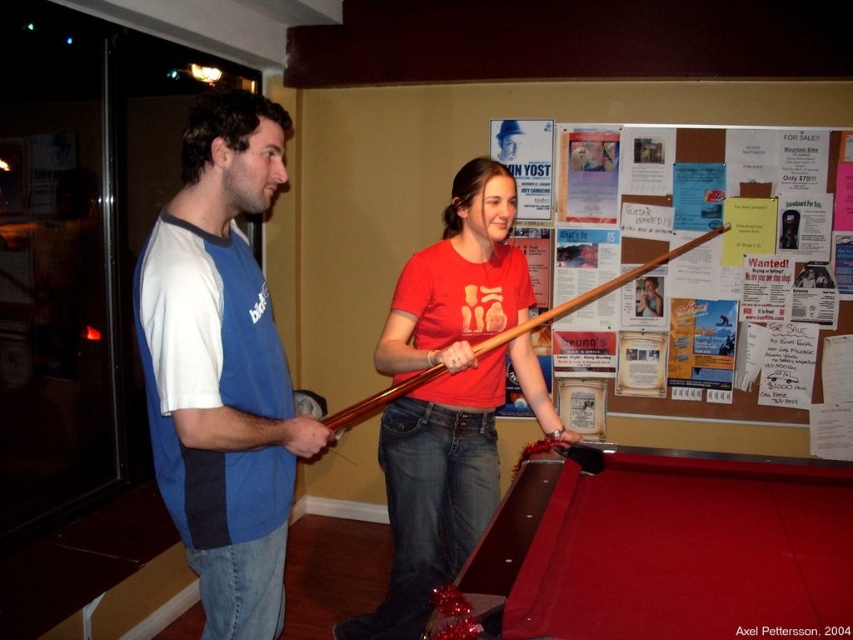
You are planning to place a 1.5 meter wide decorative shelf on the wall where the wooden poster at upper right is currently hanging. Based on the scene, will the shelf fit if the red felt pool table at lower center is positioned directly in front of the wall?

The red felt pool table at lower center has a width less than the wooden poster at upper right. Since the shelf is 1.5 meters wide and the wooden poster is wider, the shelf should fit as it matches the poster width. However, the pool table being in front might block access but not the space. Proceed cautiously.

You are a person who is 1.8 meters tall and standing in front of the red felt pool table at lower center. Can you comfortably reach the top of the table without bending down?

The red felt pool table at lower center is 1.30 meters away from the viewer. However, the height of the table is not provided in the description, so it is impossible to determine if you can reach the top without bending down.

You are standing in the room and want to move from point A to point B. Point A is at coordinates point (679, 272) and point B is at coordinates point (704, 234). Which point is closer to you?

Point (679, 272) is further to the viewer than point (704, 234). Therefore, point B at (704, 234) is closer to you.